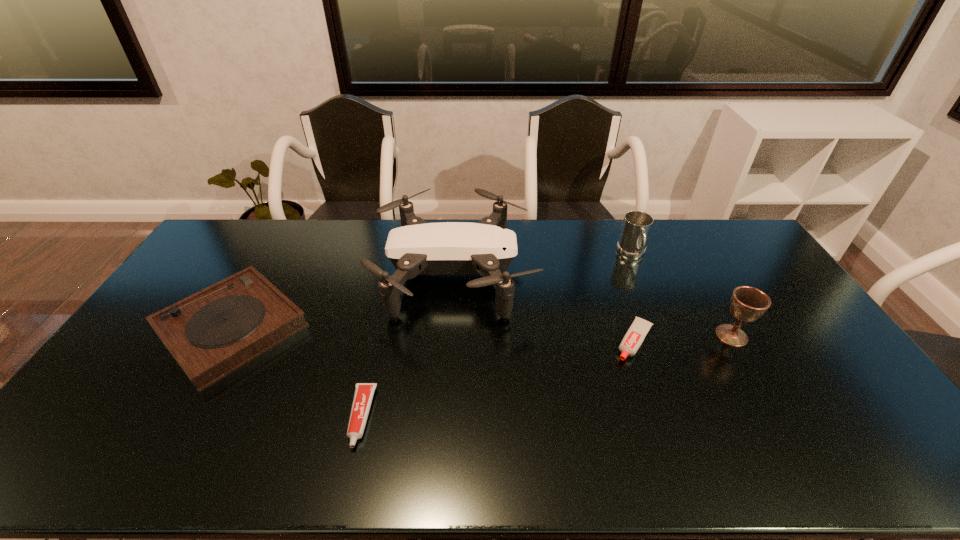
Where is `blank space located on the back of the phonograph record`? The height and width of the screenshot is (540, 960). blank space located on the back of the phonograph record is located at coordinates (273, 256).

Where is `blank area located on the back of the right toothpaste`? blank area located on the back of the right toothpaste is located at coordinates (606, 257).

Locate an element on the screen. This screenshot has height=540, width=960. free region located at the nozzle of the left toothpaste is located at coordinates (348, 476).

Image resolution: width=960 pixels, height=540 pixels. I want to click on drone that is at the far edge, so [486, 248].

This screenshot has width=960, height=540. I want to click on mug positioned at the far edge, so click(x=636, y=228).

The image size is (960, 540). Identify the location of object present at the near edge. 364,392.

This screenshot has width=960, height=540. I want to click on object present at the left edge, so click(x=210, y=334).

You are a GUI agent. You are given a task and a screenshot of the screen. Output one action in this format:
    pyautogui.click(x=<x>, y=<y>)
    Task: Click on the free space at the far edge of the desktop
    
    Given the screenshot: What is the action you would take?
    pyautogui.click(x=581, y=251)

Locate an element on the screen. free spot at the near edge of the desktop is located at coordinates (443, 465).

Locate an element on the screen. free region at the left edge is located at coordinates (142, 342).